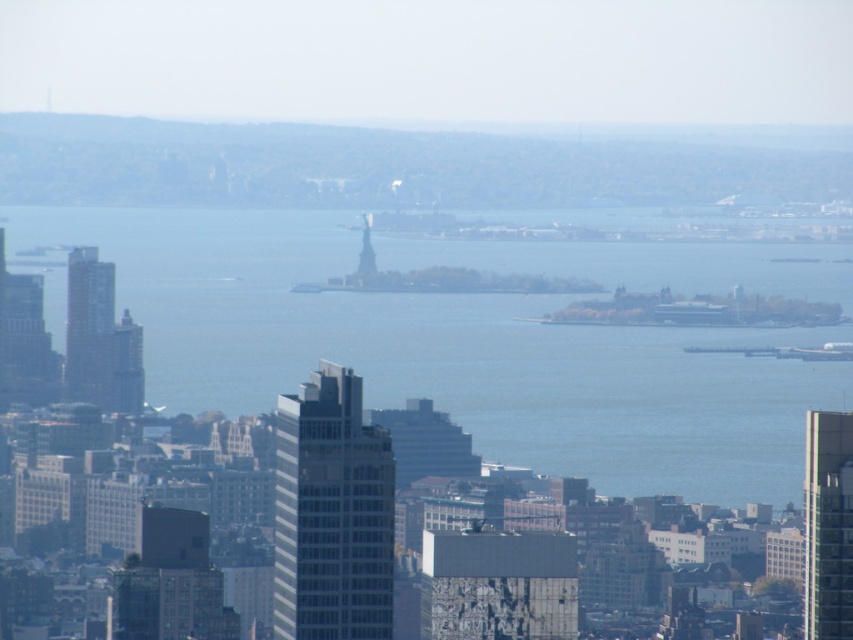
You are a drone operator trying to deliver a package to the point marked by the coordinates point (450, 353). Based on the cityscape image, what is the most likely location of this point?

The point (450, 353) corresponds to the blue water at center, so the package should be delivered to the blue water at center.

You are a city planner analyzing the city layout. Based on the image, which object is positioned higher in the scene between the blue water at center and the white glass building at center?

The blue water at center is positioned higher than the white glass building at center according to the scene description.